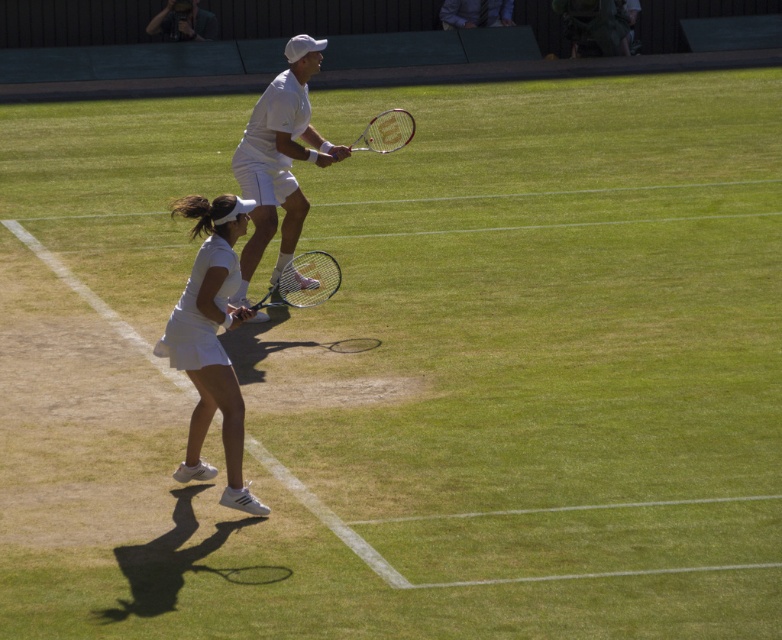
Who is shorter, white matte tennis skirt at lower left or blue metallic tennis racket at center?

blue metallic tennis racket at center is shorter.

Which is below, white matte tennis skirt at lower left or blue metallic tennis racket at center?

white matte tennis skirt at lower left is below.

Identify the location of white matte tennis skirt at lower left. (210, 342).

Who is more distant from viewer, (192, 460) or (231, 296)?

Point (231, 296)

This screenshot has width=782, height=640. Describe the element at coordinates (210, 342) in the screenshot. I see `white matte tennis skirt at lower left` at that location.

Is point (185, 481) behind point (339, 148)?

No, (185, 481) is in front of (339, 148).

Find the location of `white matte tennis skirt at lower left`. white matte tennis skirt at lower left is located at coordinates (210, 342).

Consider the image. Who is more forward, (257, 198) or (253, 305)?

Positioned in front is point (257, 198).

Is white matte tennis racket at center taller than blue metallic tennis racket at center?

Correct, white matte tennis racket at center is much taller as blue metallic tennis racket at center.

You are a GUI agent. You are given a task and a screenshot of the screen. Output one action in this format:
    pyautogui.click(x=<x>, y=<y>)
    Task: Click on the white matte tennis racket at center
    
    Given the screenshot: What is the action you would take?
    pyautogui.click(x=278, y=157)

Locate an element on the screen. This screenshot has width=782, height=640. white matte tennis racket at center is located at coordinates (278, 157).